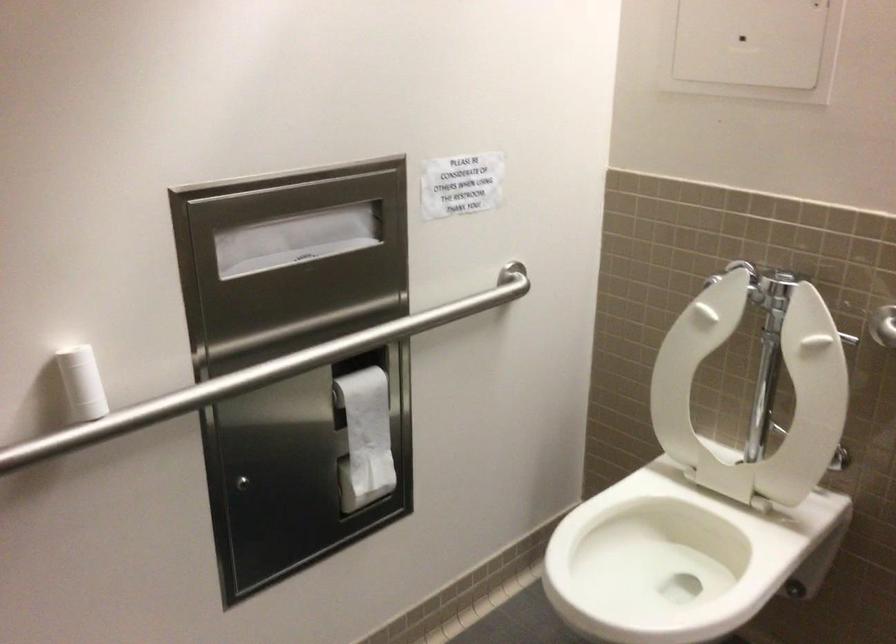
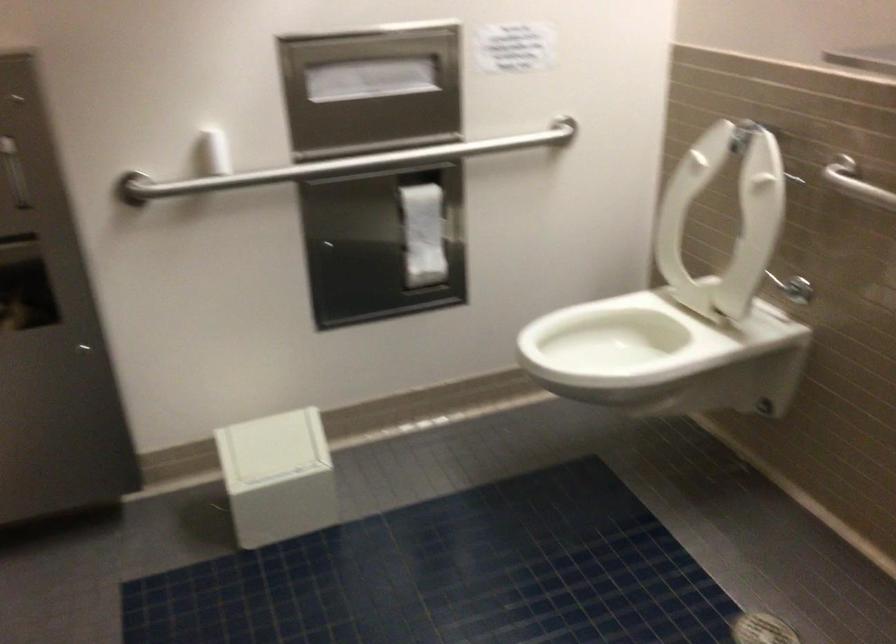
Question: Based on the continuous images, in which direction is the camera rotating? Reply with the corresponding letter.

Choices:
 (A) Left
 (B) Right
 (C) Up
 (D) Down

Answer: (A)